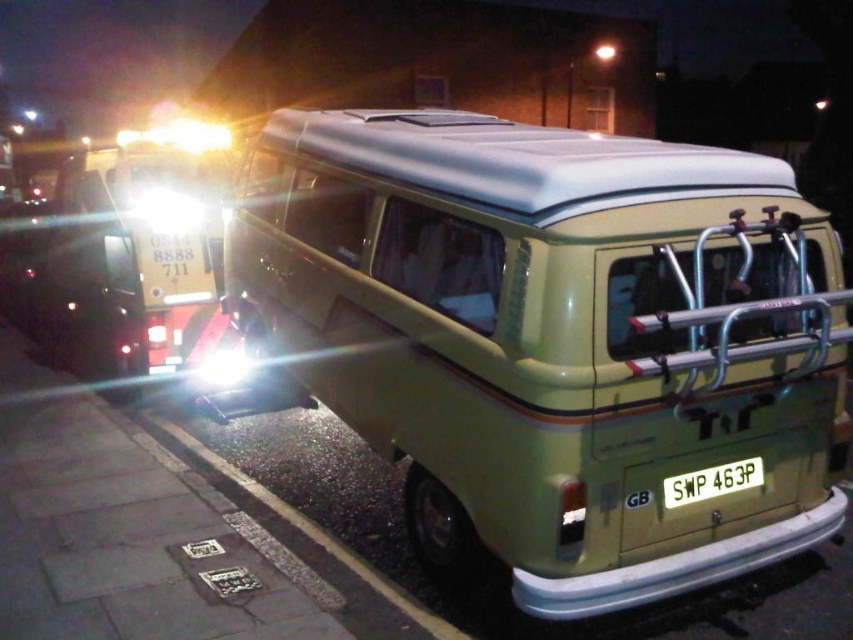
You are a photographer taking a picture of the matte green van at center and the white plastic license plate at center. Which object will appear larger in your photo?

The matte green van at center will appear larger in the photo because it is closer to the viewer than the white plastic license plate at center.

You are a photographer trying to capture the van from the front. You notice two points marked on the van in the image. One is at point coordinates point (x=821, y=328) and the other is at point coordinates point (x=173, y=196). Which point is closer to the camera?

Point (x=821, y=328) is closer to the camera than point (x=173, y=196).

You are standing 5 feet away from the camera. You want to reach the point at coordinate (686, 280). How many more feet do you need to walk to get there?

The point at coordinate (686, 280) is 10.95 feet from the camera. Since you are already 5 feet away from the camera, you need to walk an additional 5.95 feet to reach it.